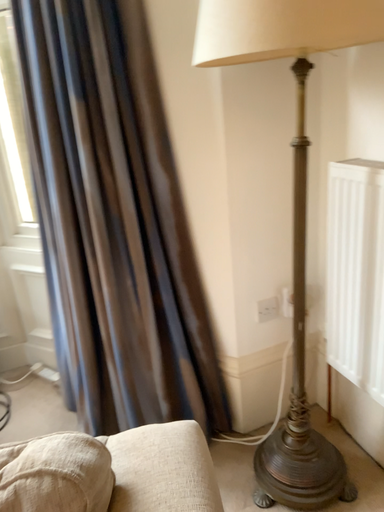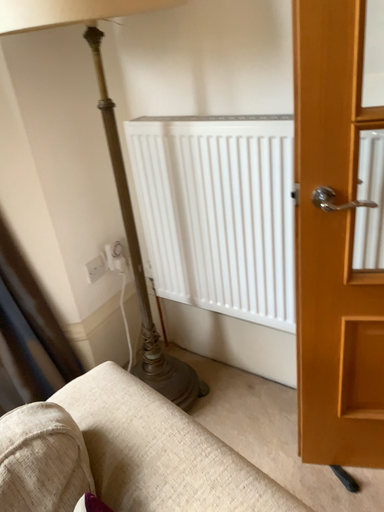
Question: Which way did the camera rotate in the video?

Choices:
 (A) rotated left
 (B) rotated right

Answer: (B)